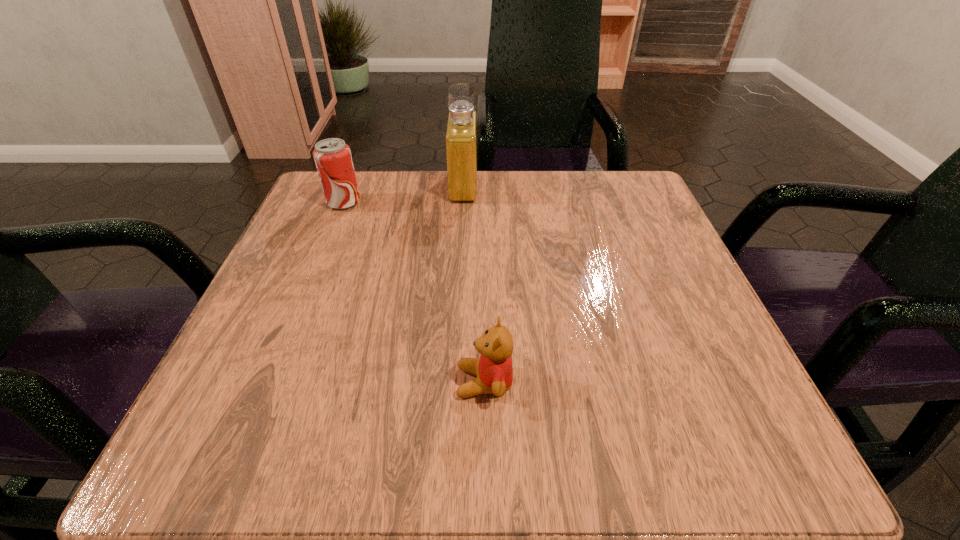
I want to click on the tallest object, so click(461, 128).

In order to click on soda can in this screenshot , I will do `click(333, 159)`.

The width and height of the screenshot is (960, 540). I want to click on the leftmost object, so click(x=333, y=159).

Find the location of `teddy bear`. teddy bear is located at coordinates (494, 370).

Identify the location of the nearest object. Image resolution: width=960 pixels, height=540 pixels. (494, 370).

This screenshot has height=540, width=960. Identify the location of vacant region located on the front-facing side of the tallest object. (598, 186).

At what (x,y) coordinates should I click in order to perform the action: click on free space located on the right of the second tallest object. Please return your answer as a coordinate pair (x, y). This screenshot has width=960, height=540. Looking at the image, I should click on (488, 202).

At what (x,y) coordinates should I click in order to perform the action: click on vacant space located on the front-facing side of the teddy bear. Please return your answer as a coordinate pair (x, y). Looking at the image, I should click on (212, 382).

Identify the location of free space located on the front-facing side of the teddy bear. Image resolution: width=960 pixels, height=540 pixels. click(234, 382).

Where is `free location located 0.150m on the front-facing side of the teddy bear`? This screenshot has height=540, width=960. free location located 0.150m on the front-facing side of the teddy bear is located at coordinates (349, 382).